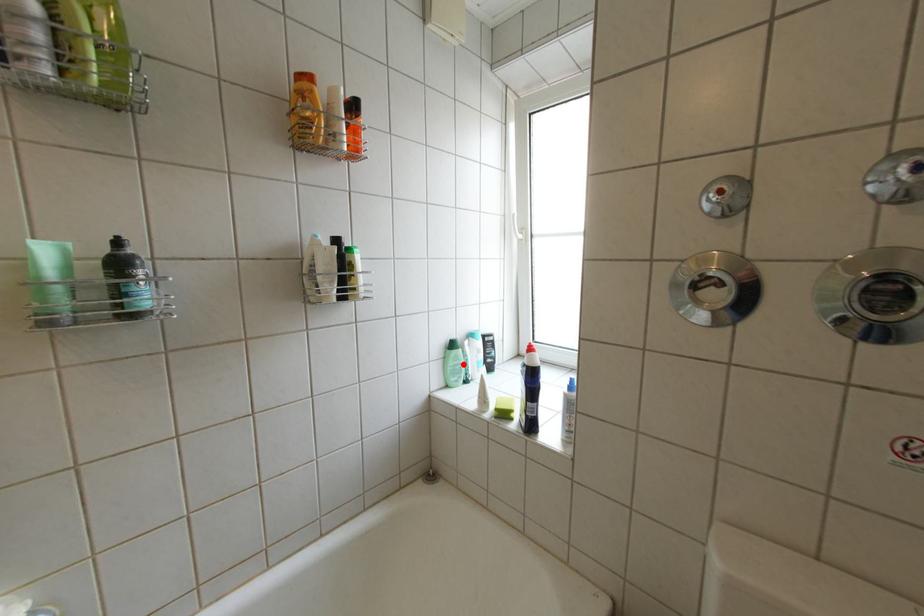
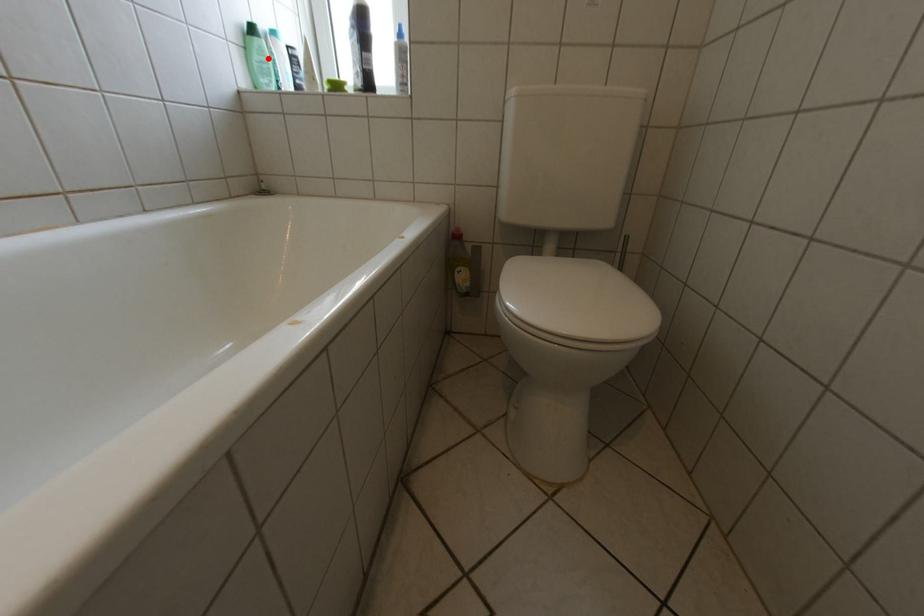
I am providing you with two images of the same scene from different viewpoints. A red point is marked on the first image and another point is marked on the second image. Does the point marked in image1 correspond to the same location as the one in image2?

Yes